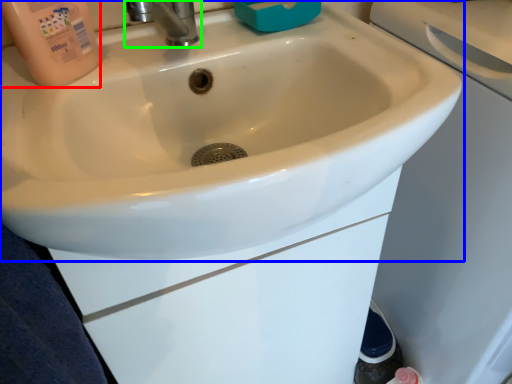
Question: Which object is positioned closest to cleaning product (highlighted by a red box)? Select from sink (highlighted by a blue box) and tap (highlighted by a green box).

Choices:
 (A) sink
 (B) tap

Answer: (B)